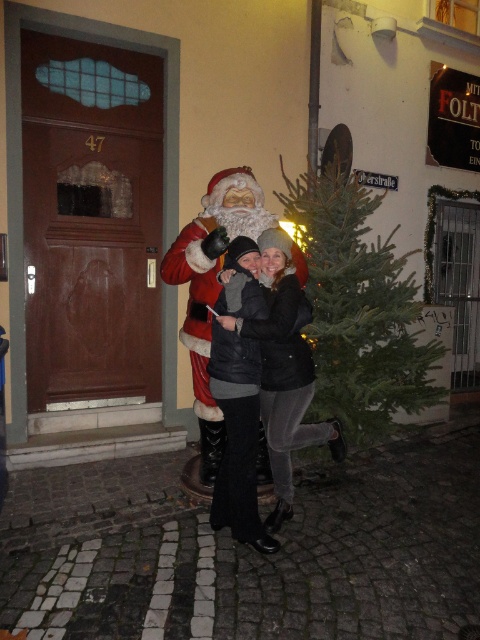
Question: Among these points, which one is nearest to the camera?

Choices:
 (A) (285, 468)
 (B) (324, 323)
 (C) (188, 227)

Answer: (A)

Question: Is black leather jacket at center below red plush santa at center?

Choices:
 (A) no
 (B) yes

Answer: (B)

Question: Which point appears closest to the camera in this image?

Choices:
 (A) pos(243,188)
 (B) pos(300,432)
 (C) pos(393,316)

Answer: (B)

Question: Which object is positioned closest to the green matte christmas tree at center?

Choices:
 (A) black leather jacket at center
 (B) red plush santa at center

Answer: (A)

Question: Observing the image, what is the correct spatial positioning of green matte christmas tree at center in reference to red plush santa at center?

Choices:
 (A) above
 (B) below

Answer: (A)

Question: Can you confirm if green matte christmas tree at center is smaller than black leather jacket at center?

Choices:
 (A) no
 (B) yes

Answer: (A)